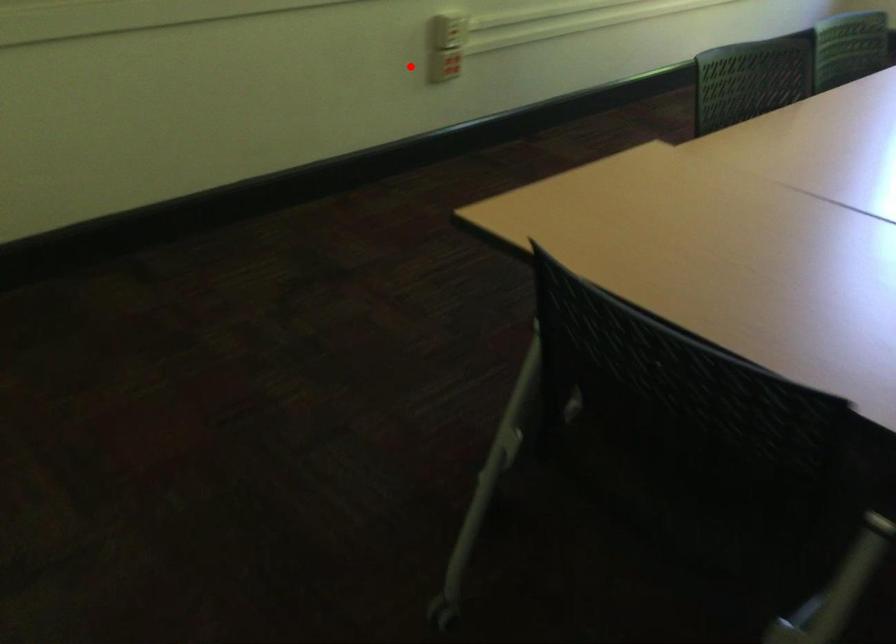
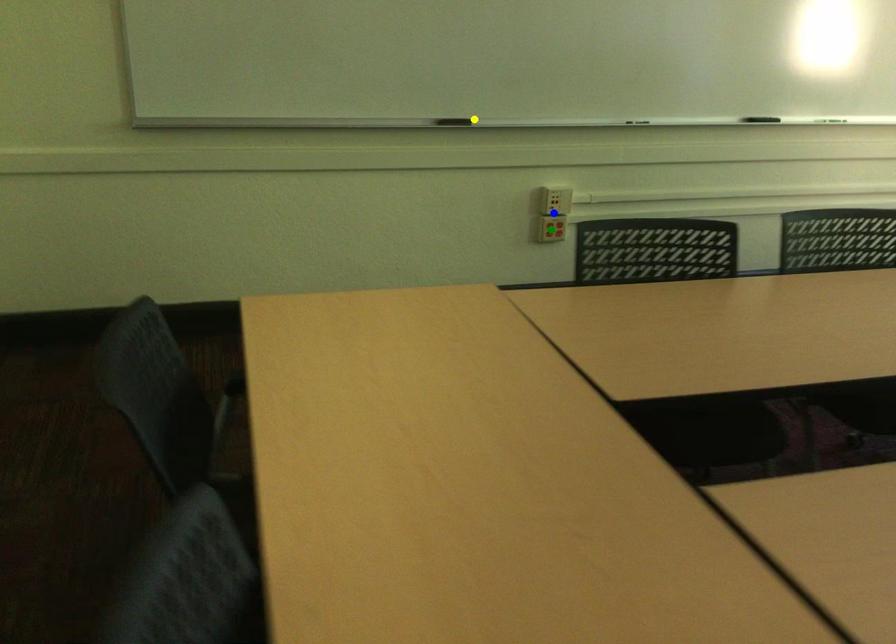
Question: I am providing you with two images of the same scene from different viewpoints. A red point is marked on the first image. You are given multiple points on the second image. Which point in image 2 is actually the same real-world point as the red point in image 1?

Choices:
 (A) blue point
 (B) yellow point
 (C) green point

Answer: (C)